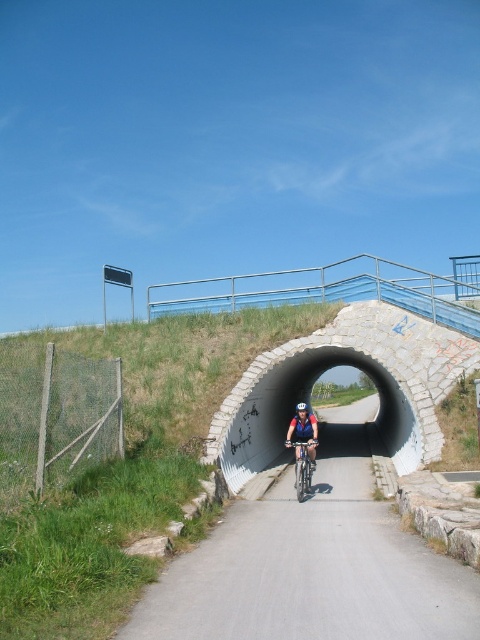
Question: Estimate the real-world distances between objects in this image. Which object is farther from the shiny metallic bicycle at center?

Choices:
 (A) white matte bicycle helmet at center
 (B) matte blue helmet at center

Answer: (A)

Question: Is shiny metallic bicycle at center to the left of white matte bicycle helmet at center from the viewer's perspective?

Choices:
 (A) yes
 (B) no

Answer: (A)

Question: Which object is farther from the camera taking this photo?

Choices:
 (A) shiny metallic bicycle at center
 (B) matte blue helmet at center
 (C) white matte bicycle helmet at center

Answer: (B)

Question: Among these points, which one is farthest from the camera?

Choices:
 (A) (297, 408)
 (B) (291, 420)
 (C) (292, 445)

Answer: (A)

Question: Does matte blue helmet at center appear on the right side of shiny metallic bicycle at center?

Choices:
 (A) yes
 (B) no

Answer: (A)

Question: Is matte blue helmet at center further to camera compared to white matte bicycle helmet at center?

Choices:
 (A) no
 (B) yes

Answer: (B)